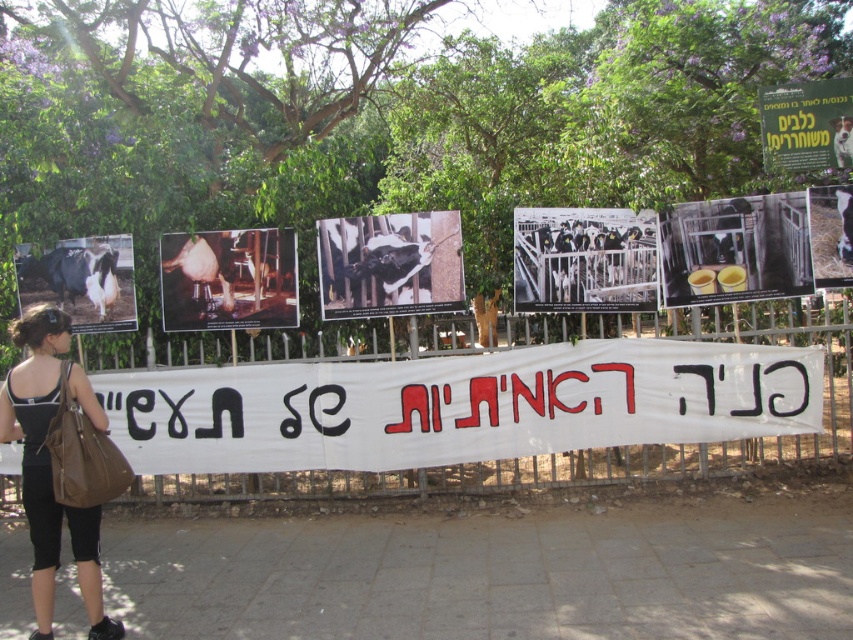
Looking at this image, you are an animal rights activist standing in front of the fence with the photos and banner. You have a black leather bag at lower left and see a metallic silver cow at center. Which object is taller?

The black leather bag at lower left is taller than the metallic silver cow at center.